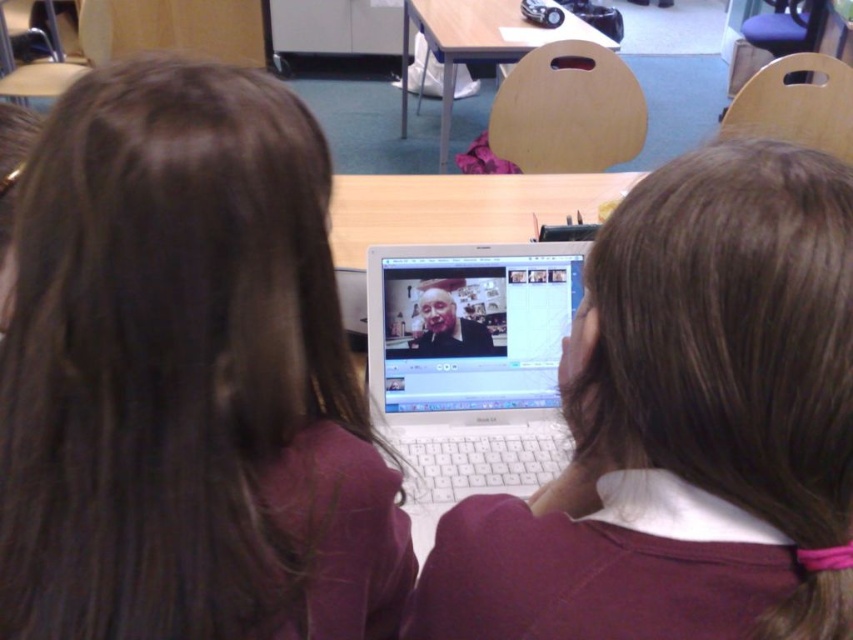
You are a student trying to place a textbook on the wooden table at center so it doesn t block the silver metallic laptop at center. Based on their positions, where should you place the textbook?

The silver metallic laptop at center is on the left side of the wooden table at center, so placing the textbook on the right side of the wooden table at center would avoid blocking the laptop.

You are a student in the classroom and want to place your backpack on the wooden table at center. However, there is a silver metallic laptop at center already on it. Can you still place your backpack there without moving the laptop?

The silver metallic laptop at center is positioned under the wooden table at center, so the laptop is not on the table. Therefore, you can safely place your backpack on the wooden table at center without moving anything.